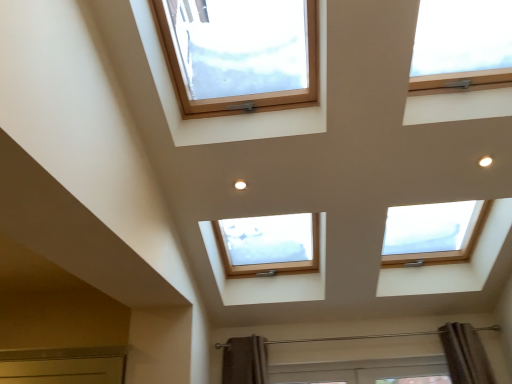
This screenshot has width=512, height=384. What do you see at coordinates (249, 90) in the screenshot? I see `clear glass window at upper left, the 2th window when ordered from right to left` at bounding box center [249, 90].

Where is `clear glass window at upper left, the first window from the left`? This screenshot has height=384, width=512. clear glass window at upper left, the first window from the left is located at coordinates (249, 90).

Measure the distance between point (203,3) and camera.

They are 2.18 meters apart.

Looking at this image, measure the distance between clear glass window at upper left, the first window from the left, and camera.

clear glass window at upper left, the first window from the left, is 5.88 feet away from camera.

Where is `natural wood window at upper right, the first window in the right-to-left sequence`? The width and height of the screenshot is (512, 384). natural wood window at upper right, the first window in the right-to-left sequence is located at coordinates (462, 44).

What do you see at coordinates (462, 44) in the screenshot?
I see `natural wood window at upper right, which appears as the 2th window when viewed from the left` at bounding box center [462, 44].

I want to click on clear glass window at upper left, the first window from the left, so click(x=249, y=90).

Would you say natural wood window at upper right, which appears as the 2th window when viewed from the left, is to the left or to the right of clear glass window at upper left, the 2th window when ordered from right to left, in the picture?

Clearly, natural wood window at upper right, which appears as the 2th window when viewed from the left, is on the right of clear glass window at upper left, the 2th window when ordered from right to left, in the image.

Which is behind, natural wood window at upper right, which appears as the 2th window when viewed from the left, or clear glass window at upper left, the first window from the left?

natural wood window at upper right, which appears as the 2th window when viewed from the left, is further from the camera.

Considering the points (435, 6) and (223, 105), which point is in front, point (435, 6) or point (223, 105)?

Positioned in front is point (435, 6).

Based on the photo, from the image's perspective, is natural wood window at upper right, which appears as the 2th window when viewed from the left, located beneath clear glass window at upper left, the first window from the left?

Actually, natural wood window at upper right, which appears as the 2th window when viewed from the left, appears above clear glass window at upper left, the first window from the left, in the image.

Looking at this image, from a real-world perspective, is natural wood window at upper right, which appears as the 2th window when viewed from the left, below clear glass window at upper left, the first window from the left?

Yes, from a real-world perspective, natural wood window at upper right, which appears as the 2th window when viewed from the left, is beneath clear glass window at upper left, the first window from the left.

Considering the relative sizes of natural wood window at upper right, which appears as the 2th window when viewed from the left, and clear glass window at upper left, the 2th window when ordered from right to left, in the image provided, is natural wood window at upper right, which appears as the 2th window when viewed from the left, thinner than clear glass window at upper left, the 2th window when ordered from right to left,?

Indeed, natural wood window at upper right, which appears as the 2th window when viewed from the left, has a lesser width compared to clear glass window at upper left, the 2th window when ordered from right to left.

Between natural wood window at upper right, the first window in the right-to-left sequence, and clear glass window at upper left, the 2th window when ordered from right to left, which one has less height?

natural wood window at upper right, the first window in the right-to-left sequence, is shorter.

Looking at this image, considering the sizes of objects natural wood window at upper right, which appears as the 2th window when viewed from the left, and clear glass window at upper left, the 2th window when ordered from right to left, in the image provided, who is bigger, natural wood window at upper right, which appears as the 2th window when viewed from the left, or clear glass window at upper left, the 2th window when ordered from right to left,?

Bigger between the two is clear glass window at upper left, the 2th window when ordered from right to left.

From the picture: Is natural wood window at upper right, the first window in the right-to-left sequence, positioned beyond the bounds of clear glass window at upper left, the 2th window when ordered from right to left?

Indeed, natural wood window at upper right, the first window in the right-to-left sequence, is completely outside clear glass window at upper left, the 2th window when ordered from right to left.

Would you say natural wood window at upper right, the first window in the right-to-left sequence, is a long distance from clear glass window at upper left, the 2th window when ordered from right to left?

No, natural wood window at upper right, the first window in the right-to-left sequence, is in close proximity to clear glass window at upper left, the 2th window when ordered from right to left.

Is natural wood window at upper right, the first window in the right-to-left sequence, oriented towards clear glass window at upper left, the first window from the left?

No, natural wood window at upper right, the first window in the right-to-left sequence, is not aimed at clear glass window at upper left, the first window from the left.

Consider the image. How many degrees apart are the facing directions of natural wood window at upper right, which appears as the 2th window when viewed from the left, and clear glass window at upper left, the first window from the left?

natural wood window at upper right, which appears as the 2th window when viewed from the left, and clear glass window at upper left, the first window from the left, are facing 1.88e-05 degrees away from each other.

This screenshot has height=384, width=512. What are the coordinates of `window located in front of the natural wood window at upper right, which appears as the 2th window when viewed from the left` in the screenshot? It's located at (249, 90).

Which object is positioned more to the left, clear glass window at upper left, the 2th window when ordered from right to left, or natural wood window at upper right, which appears as the 2th window when viewed from the left?

clear glass window at upper left, the 2th window when ordered from right to left, is more to the left.

Relative to natural wood window at upper right, the first window in the right-to-left sequence, is clear glass window at upper left, the first window from the left, in front or behind?

In the image, clear glass window at upper left, the first window from the left, appears in front of natural wood window at upper right, the first window in the right-to-left sequence.

Considering the positions of point (315, 77) and point (494, 79), is point (315, 77) closer or farther from the camera than point (494, 79)?

Point (315, 77) is farther from the camera than point (494, 79).

From the image's perspective, which one is positioned higher, clear glass window at upper left, the 2th window when ordered from right to left, or natural wood window at upper right, the first window in the right-to-left sequence?

natural wood window at upper right, the first window in the right-to-left sequence, is shown above in the image.

Based on the photo, from a real-world perspective, is clear glass window at upper left, the 2th window when ordered from right to left, physically above natural wood window at upper right, the first window in the right-to-left sequence?

Yes, from a real-world perspective, clear glass window at upper left, the 2th window when ordered from right to left, is above natural wood window at upper right, the first window in the right-to-left sequence.

Can you confirm if clear glass window at upper left, the 2th window when ordered from right to left, is thinner than natural wood window at upper right, which appears as the 2th window when viewed from the left?

Incorrect, the width of clear glass window at upper left, the 2th window when ordered from right to left, is not less than that of natural wood window at upper right, which appears as the 2th window when viewed from the left.

Based on the photo, considering the sizes of objects clear glass window at upper left, the first window from the left, and natural wood window at upper right, which appears as the 2th window when viewed from the left, in the image provided, who is shorter, clear glass window at upper left, the first window from the left, or natural wood window at upper right, which appears as the 2th window when viewed from the left,?

With less height is natural wood window at upper right, which appears as the 2th window when viewed from the left.

Can you confirm if clear glass window at upper left, the 2th window when ordered from right to left, is bigger than natural wood window at upper right, the first window in the right-to-left sequence?

Indeed, clear glass window at upper left, the 2th window when ordered from right to left, has a larger size compared to natural wood window at upper right, the first window in the right-to-left sequence.

Is clear glass window at upper left, the 2th window when ordered from right to left, surrounding natural wood window at upper right, the first window in the right-to-left sequence?

No, clear glass window at upper left, the 2th window when ordered from right to left, does not contain natural wood window at upper right, the first window in the right-to-left sequence.

Are clear glass window at upper left, the first window from the left, and natural wood window at upper right, which appears as the 2th window when viewed from the left, making contact?

clear glass window at upper left, the first window from the left, is not next to natural wood window at upper right, which appears as the 2th window when viewed from the left, and they're not touching.

Is clear glass window at upper left, the first window from the left, turned away from natural wood window at upper right, the first window in the right-to-left sequence?

That's not correct — clear glass window at upper left, the first window from the left, is not looking away from natural wood window at upper right, the first window in the right-to-left sequence.

Locate an element on the screen. The height and width of the screenshot is (384, 512). window on the right of the clear glass window at upper left, the 2th window when ordered from right to left is located at coordinates (462, 44).

Locate an element on the screen. Image resolution: width=512 pixels, height=384 pixels. window above the clear glass window at upper left, the 2th window when ordered from right to left (from the image's perspective) is located at coordinates (462, 44).

The height and width of the screenshot is (384, 512). What are the coordinates of `window behind the clear glass window at upper left, the first window from the left` in the screenshot? It's located at (462, 44).